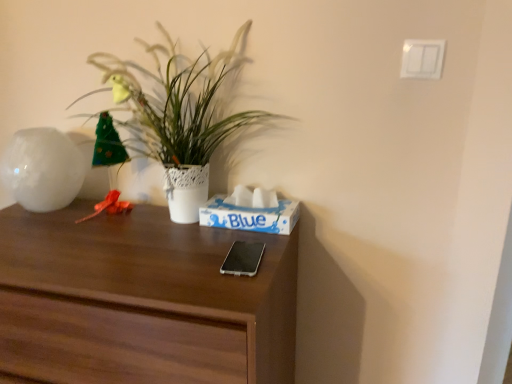
Identify the location of vacant area that lies between white glossy vase at left and silver metallic phone at center. (150, 240).